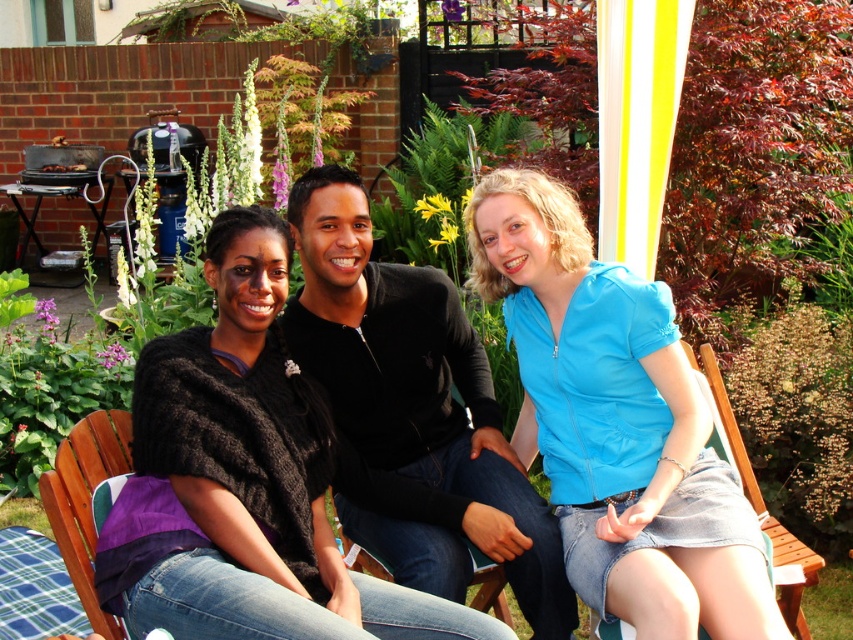
You are standing in the garden and want to place a small flower pot at the point marked as point (413, 413). Which object should you place it on?

The point (413, 413) is located on the black matte sweater at center, so you should place the flower pot on the black matte sweater at center.

You are trying to decide whether to place a new rectangular table between the black matte sweater at center and the purple fabric chair at lower left. The table is 1.2 meters wide. Can the table fit between them if the space between the two objects is equal to the difference in their widths?

The black matte sweater at center is wider than the purple fabric chair at lower left. The difference in their widths would be the space between them. Since the table is 1.2 meters wide and the space is only the difference between the two widths, it might not be sufficient. However, without knowing the exact widths, we cannot definitively determine if the table will fit.

You are a photographer setting up for a group photo and notice the black matte sweater at center and the wooden chair at lower right in the scene. Which object is taller when viewed from the photographer perspective?

The black matte sweater at center is much taller than the wooden chair at lower right.